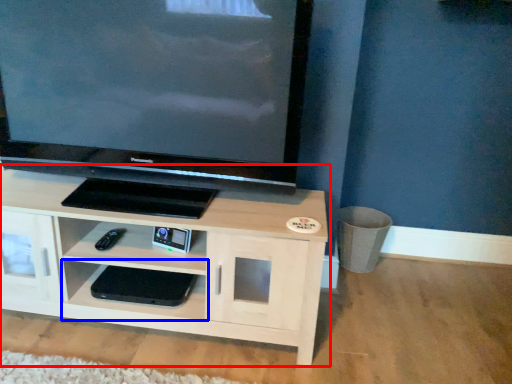
Question: Which of the following is the closest to the observer, shelf (highlighted by a red box) or shelf (highlighted by a blue box)?

Choices:
 (A) shelf
 (B) shelf

Answer: (A)